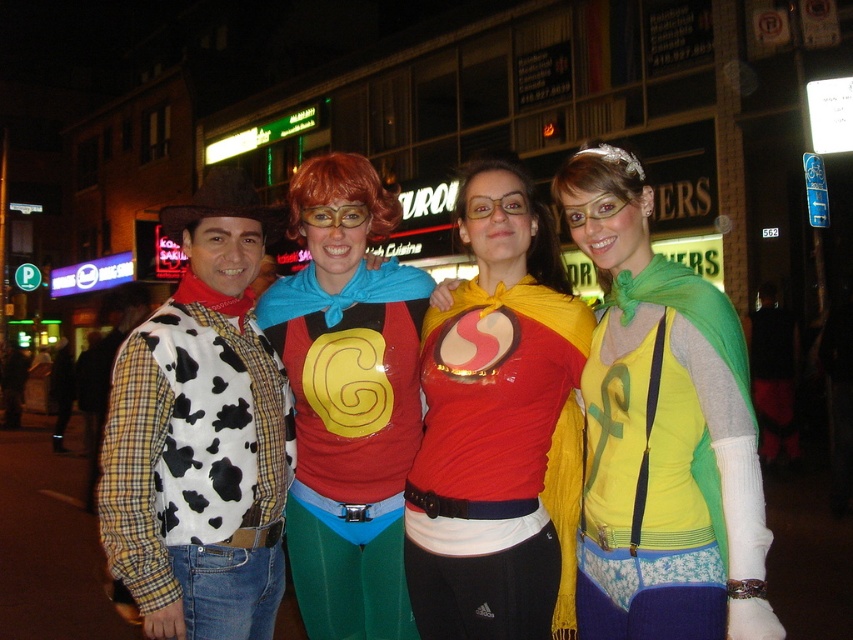
Image resolution: width=853 pixels, height=640 pixels. I want to click on cow print vest at center, so click(x=201, y=435).

Is cow print vest at center behind rubberized red and yellow shirt at center?

No, cow print vest at center is in front of rubberized red and yellow shirt at center.

Between point (248, 481) and point (402, 592), which one is positioned in front?

Point (248, 481)

Find the location of a particular element. Image resolution: width=853 pixels, height=640 pixels. cow print vest at center is located at coordinates (201, 435).

Which of these two, yellow-green jersey at center or cow print vest at center, stands shorter?

With less height is yellow-green jersey at center.

Is yellow-green jersey at center taller than cow print vest at center?

No, yellow-green jersey at center is not taller than cow print vest at center.

Measure the distance between point (x=630, y=582) and camera.

A distance of 4.65 meters exists between point (x=630, y=582) and camera.

The image size is (853, 640). In order to click on yellow-green jersey at center in this screenshot , I will do `click(662, 432)`.

Is shiny red cape at center shorter than rubberized red and yellow shirt at center?

In fact, shiny red cape at center may be taller than rubberized red and yellow shirt at center.

Is the position of shiny red cape at center less distant than that of rubberized red and yellow shirt at center?

Yes.

Measure the distance between point (561, 376) and camera.

The distance of point (561, 376) from camera is 18.09 feet.

Where is `shiny red cape at center`? Image resolution: width=853 pixels, height=640 pixels. shiny red cape at center is located at coordinates (498, 428).